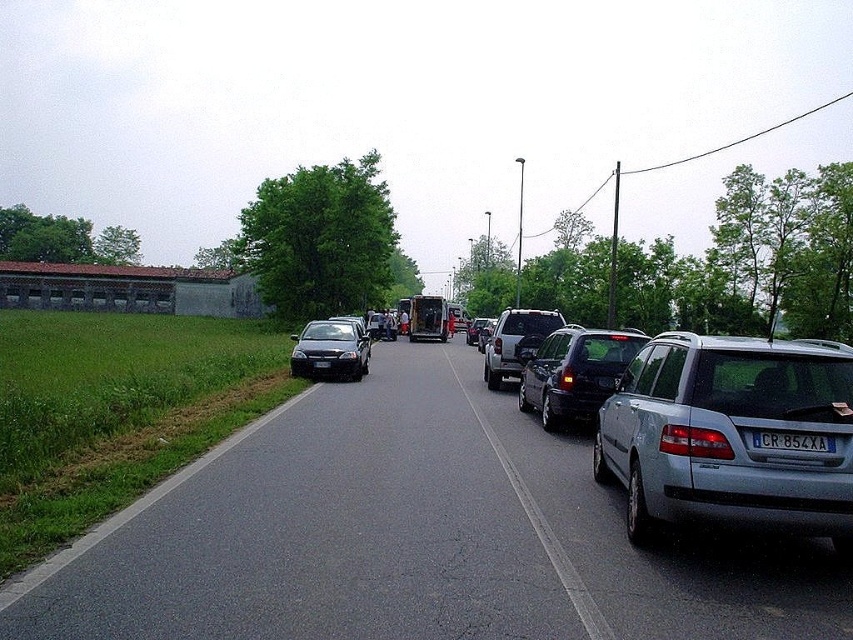
Between point (693, 456) and point (485, 374), which one is positioned in front?

Point (693, 456)

Which of these two, silver metallic station wagon at right or satin silver suv at center, stands taller?

With more height is satin silver suv at center.

Is point (788, 417) positioned behind point (521, 326)?

No, it is in front of (521, 326).

You are a GUI agent. You are given a task and a screenshot of the screen. Output one action in this format:
    pyautogui.click(x=<x>, y=<y>)
    Task: Click on the silver metallic station wagon at right
    This screenshot has width=853, height=640.
    Given the screenshot: What is the action you would take?
    pyautogui.click(x=730, y=435)

The width and height of the screenshot is (853, 640). Find the location of `satin black sedan at center`. satin black sedan at center is located at coordinates (329, 349).

Is point (316, 332) positioned in front of point (486, 324)?

Yes, it is.

You are a GUI agent. You are given a task and a screenshot of the screen. Output one action in this format:
    pyautogui.click(x=<x>, y=<y>)
    Task: Click on the satin black sedan at center
    
    Given the screenshot: What is the action you would take?
    pyautogui.click(x=329, y=349)

Between silver metallic station wagon at right and satin black car at center, which one is positioned lower?

satin black car at center is below.

Is silver metallic station wagon at right to the left of satin black car at center from the viewer's perspective?

Incorrect, silver metallic station wagon at right is not on the left side of satin black car at center.

Locate an element on the screen. This screenshot has width=853, height=640. silver metallic station wagon at right is located at coordinates (730, 435).

Locate an element on the screen. The image size is (853, 640). silver metallic station wagon at right is located at coordinates (730, 435).